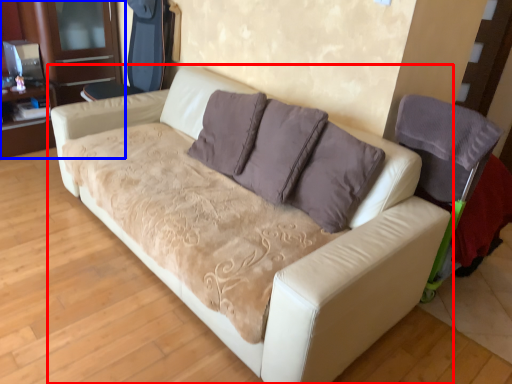
Question: Which object is further to the camera taking this photo, studio couch (highlighted by a red box) or dresser (highlighted by a blue box)?

Choices:
 (A) studio couch
 (B) dresser

Answer: (B)